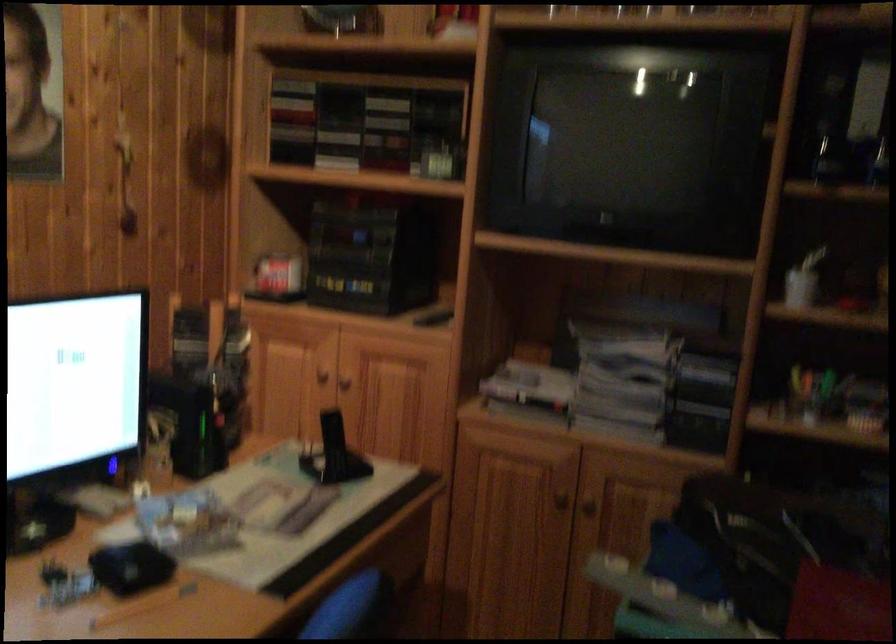
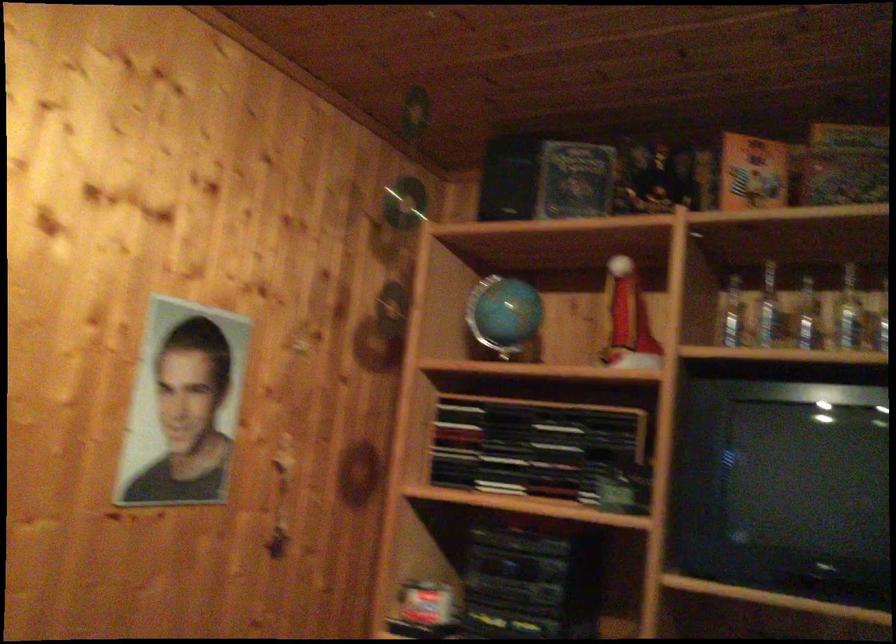
Where in the second image is the point corresponding to the point at 295,129 from the first image?

(454, 442)